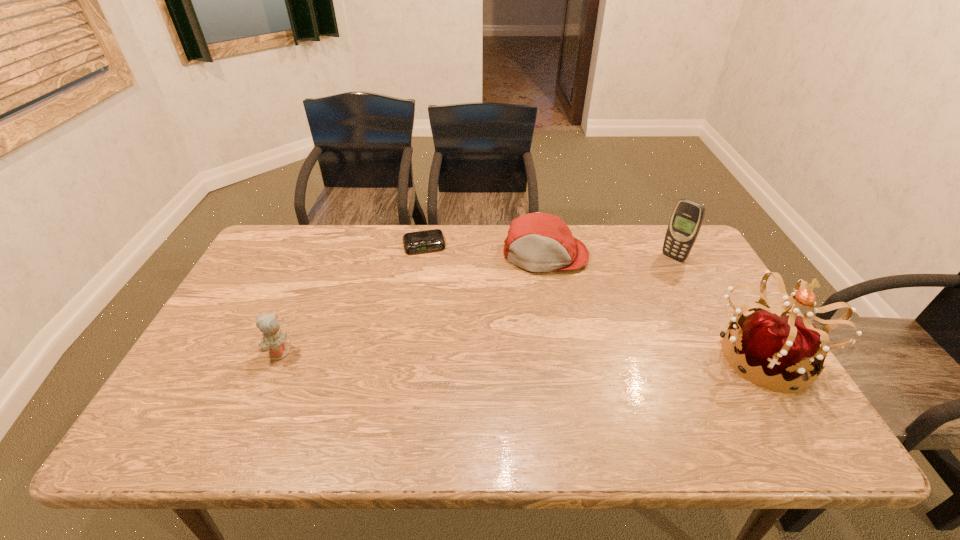
You are a GUI agent. You are given a task and a screenshot of the screen. Output one action in this format:
    pyautogui.click(x=<x>, y=<y>)
    Task: Click on the leftmost object
    Image resolution: width=960 pixels, height=540 pixels.
    Given the screenshot: What is the action you would take?
    pyautogui.click(x=273, y=342)

Where is `the tallest object`? The width and height of the screenshot is (960, 540). the tallest object is located at coordinates (786, 346).

I want to click on cellular telephone, so click(688, 215).

Locate an element on the screen. This screenshot has width=960, height=540. the shortest object is located at coordinates (432, 240).

This screenshot has width=960, height=540. Identify the location of the second object from left to right. (432, 240).

Find the location of `cap`. cap is located at coordinates (538, 242).

I want to click on free region located on the front-facing side of the leftmost object, so click(235, 353).

At what (x,y) coordinates should I click in order to perform the action: click on free space located 0.180m on the front-facing side of the leftmost object. Please return your answer as a coordinate pair (x, y). Looking at the image, I should click on (196, 353).

Find the location of `free space located on the front-facing side of the leftmost object`. free space located on the front-facing side of the leftmost object is located at coordinates (196, 353).

Where is `vacant space located 0.220m on the screen of the fourth shortest object`? vacant space located 0.220m on the screen of the fourth shortest object is located at coordinates (631, 296).